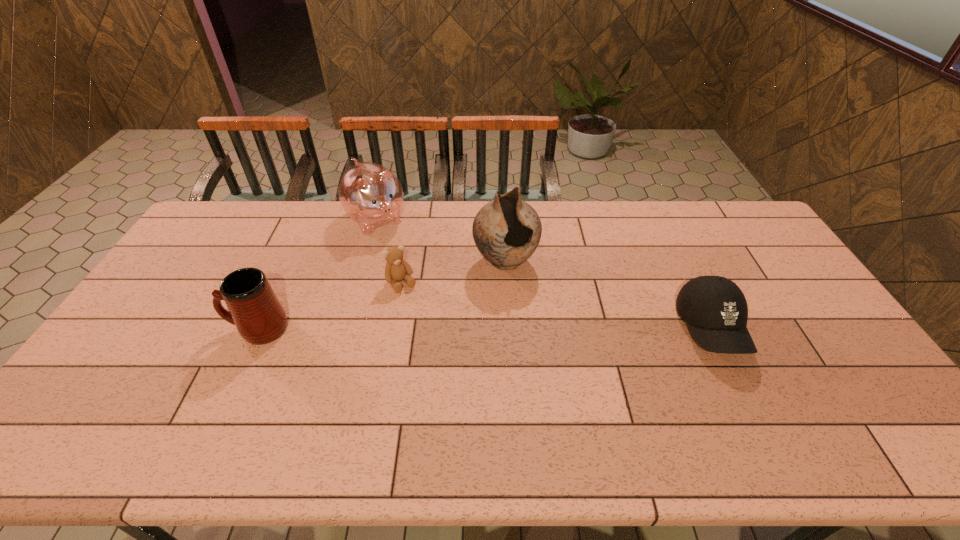
What are the coordinates of `vacant space on the desktop that is between the mug and the baseball cap and is positioned on the front-facing side of the teddy bear` in the screenshot? It's located at point(432,329).

At what (x,y) coordinates should I click in order to perform the action: click on vacant spot on the desktop that is between the leftmost object and the baseball cap and is positioned on the front facing side of the piggy bank. Please return your answer as a coordinate pair (x, y). The image size is (960, 540). Looking at the image, I should click on (473, 329).

The image size is (960, 540). What are the coordinates of `vacant space on the desktop that is between the third shortest object and the baseball cap and is positioned from the spout of the tallest object` in the screenshot? It's located at (538, 329).